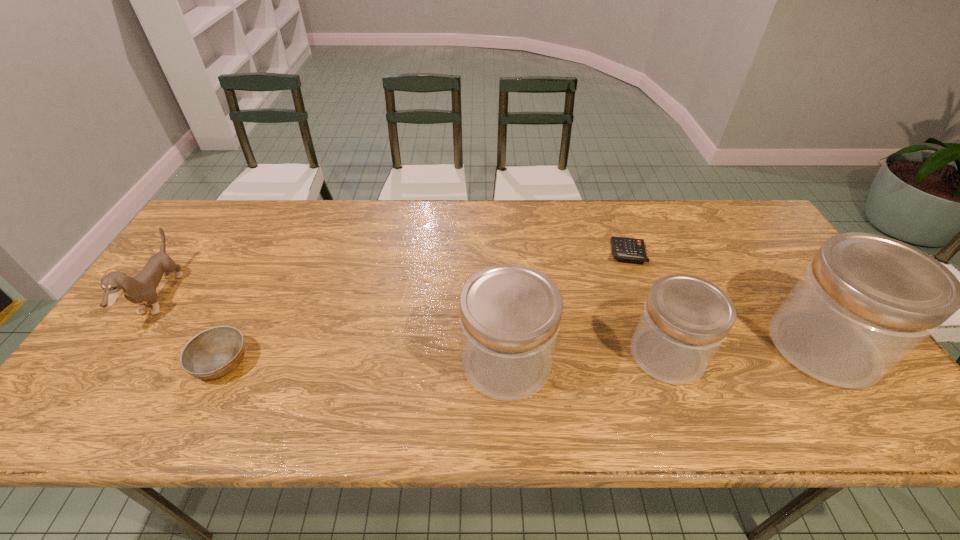
This screenshot has height=540, width=960. In order to click on the fourth object from right to left in this screenshot , I will do `click(510, 314)`.

At what (x,y) coordinates should I click in order to perform the action: click on the second tallest jar. Please return your answer as a coordinate pair (x, y). Looking at the image, I should click on (510, 314).

Identify the location of the shortest jar. This screenshot has width=960, height=540. (685, 320).

At what (x,y) coordinates should I click in order to perform the action: click on the second jar from right to left. Please return your answer as a coordinate pair (x, y). This screenshot has width=960, height=540. Looking at the image, I should click on (685, 320).

Find the location of a particular element. This screenshot has height=540, width=960. the rightmost jar is located at coordinates (865, 302).

Locate an element on the screen. Image resolution: width=960 pixels, height=540 pixels. calculator is located at coordinates click(x=633, y=249).

Locate an element on the screen. This screenshot has height=540, width=960. puppy is located at coordinates (142, 288).

Locate an element on the screen. the third shortest object is located at coordinates (142, 288).

Where is `bowl`? bowl is located at coordinates (213, 353).

At what (x,y) coordinates should I click in order to perform the action: click on the second object from left to right. Please return your answer as a coordinate pair (x, y). This screenshot has height=540, width=960. Looking at the image, I should click on (213, 353).